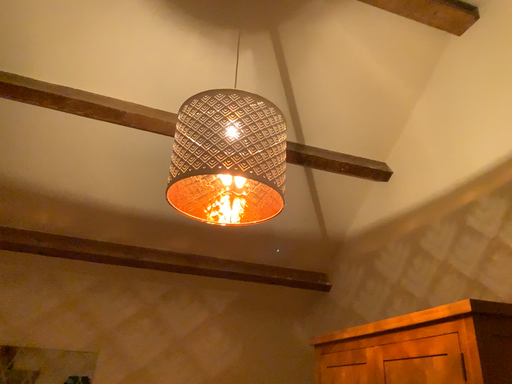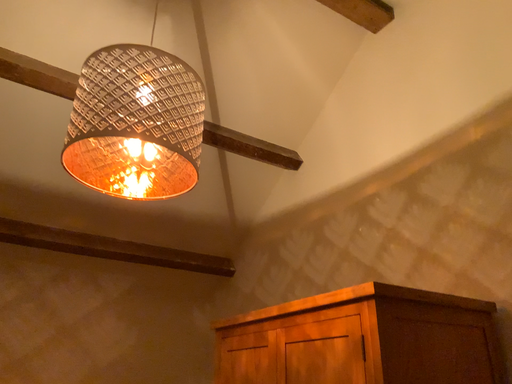
Question: How did the camera likely rotate when shooting the video?

Choices:
 (A) rotated left
 (B) rotated right

Answer: (B)